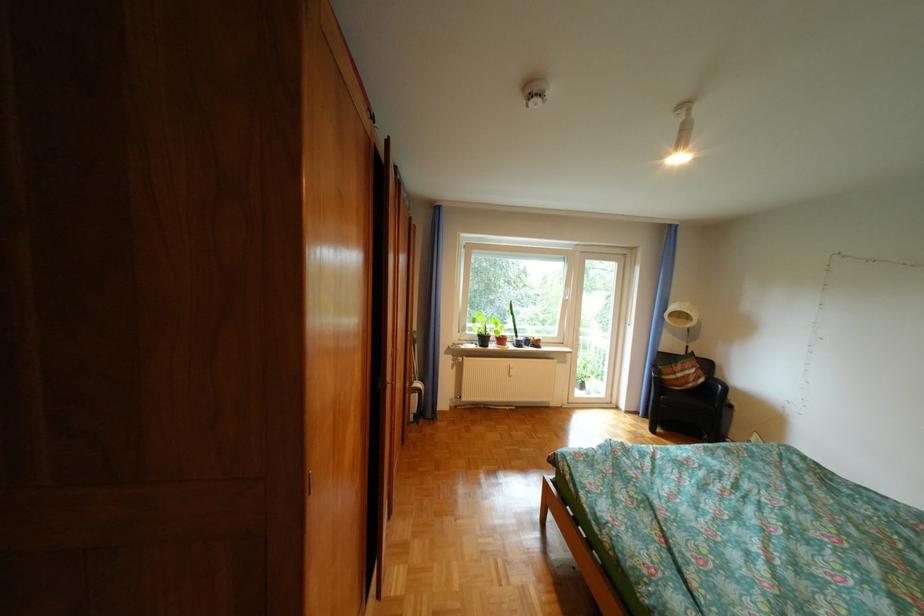
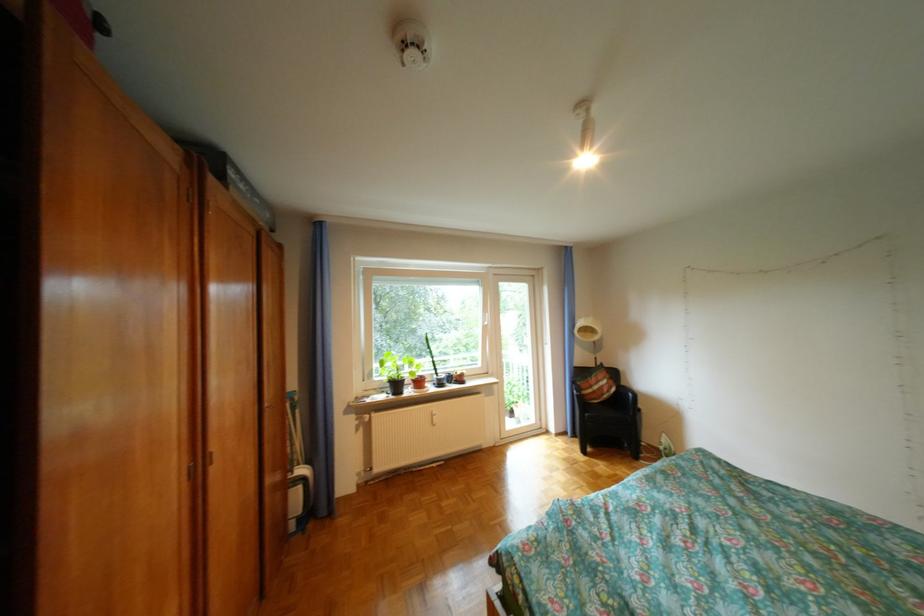
Which direction would the cameraman need to move to produce the second image?

The cameraman moved toward right, forward.